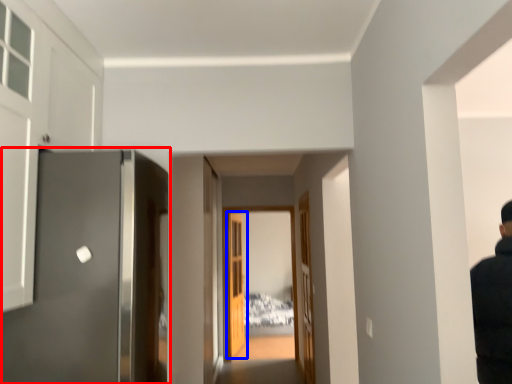
Question: Which object is further to the camera taking this photo, door (highlighted by a red box) or door (highlighted by a blue box)?

Choices:
 (A) door
 (B) door

Answer: (B)